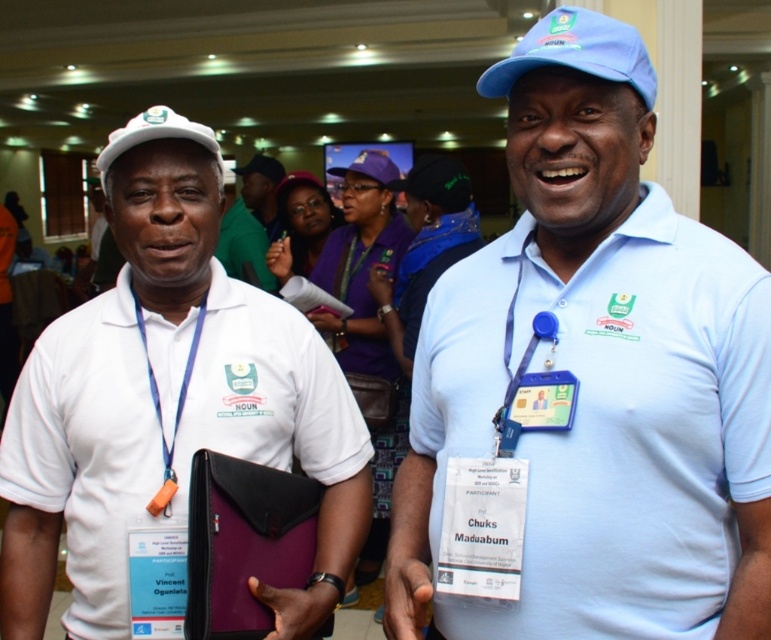
You are a photographer at an event. You need to take a photo of the light blue polo shirt at center. Your camera has a minimum focus distance of 1 meter. Can you take the photo without moving closer?

The light blue polo shirt at center and camera are 1.06 meters apart. Since the minimum focus distance is 1 meter, the camera can focus on the light blue polo shirt at center from this distance.

You are a photographer standing at a distance of 5 feet from the two individuals in the image. You want to take a closeup shot of the point at coordinates point (116, 212). Can you reach the point without moving closer than 4.7 feet?

The distance of point (116, 212) from camera is 4.71 feet, so yes, you can reach the point without moving closer than 4.7 feet since the distance is just over 4.7 feet.